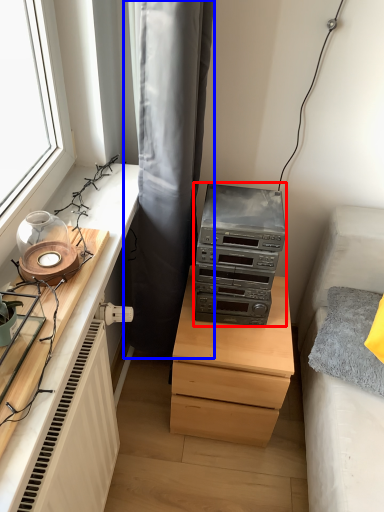
Question: Which object appears farthest to the camera in this image, stereo (highlighted by a red box) or curtain (highlighted by a blue box)?

Choices:
 (A) stereo
 (B) curtain

Answer: (A)